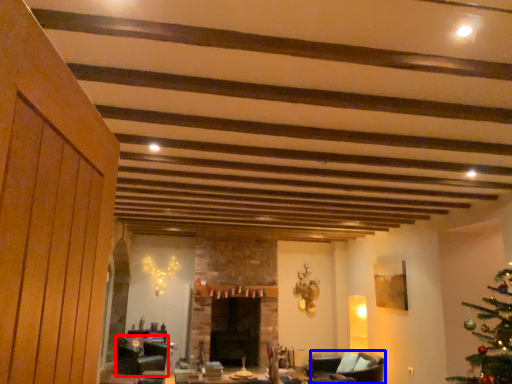
Question: Which object appears farthest to the camera in this image, swivel chair (highlighted by a red box) or armchair (highlighted by a blue box)?

Choices:
 (A) swivel chair
 (B) armchair

Answer: (A)